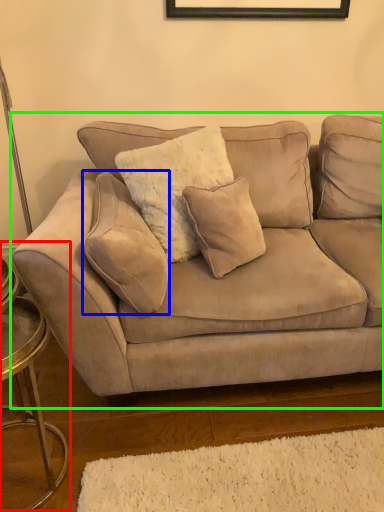
Question: Considering the real-world distances, which object is farthest from side table (highlighted by a red box)? pillow (highlighted by a blue box) or studio couch (highlighted by a green box)?

Choices:
 (A) pillow
 (B) studio couch

Answer: (B)